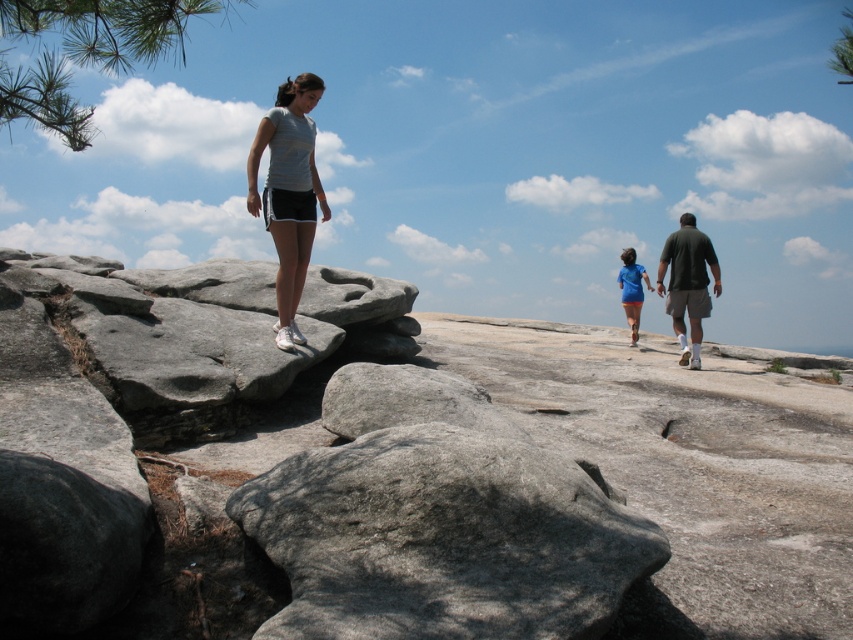
Question: Considering the relative positions of gray rock at upper left and blue matte shirt at center in the image provided, where is gray rock at upper left located with respect to blue matte shirt at center?

Choices:
 (A) right
 (B) left

Answer: (B)

Question: Which object is positioned farthest from the dark green fabric shirt at right?

Choices:
 (A) blue matte shirt at center
 (B) gray rock at upper left
 (C) light gray t-shirt at center

Answer: (C)

Question: Does gray rough rock at center appear under light gray t-shirt at center?

Choices:
 (A) no
 (B) yes

Answer: (B)

Question: Is gray rock at upper left further to camera compared to blue matte shirt at center?

Choices:
 (A) no
 (B) yes

Answer: (A)

Question: Based on their relative distances, which object is farther from the gray rough rock at center?

Choices:
 (A) blue matte shirt at center
 (B) gray rock at upper left
 (C) light gray t-shirt at center
 (D) dark green fabric shirt at right

Answer: (A)

Question: Which point appears farthest from the camera in this image?

Choices:
 (A) (498, 540)
 (B) (73, 419)
 (C) (695, 259)
 (D) (252, 157)

Answer: (C)